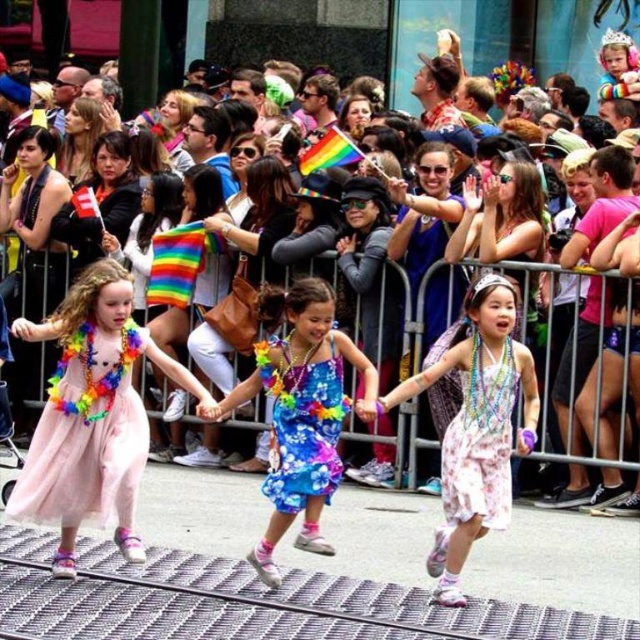
Between pearl beaded necklace at center and floral cotton dress at center, which one is positioned higher?

Positioned higher is pearl beaded necklace at center.

Is pearl beaded necklace at center below floral cotton dress at center?

No.

Describe the element at coordinates (476, 428) in the screenshot. This screenshot has width=640, height=640. I see `pearl beaded necklace at center` at that location.

Image resolution: width=640 pixels, height=640 pixels. I want to click on pearl beaded necklace at center, so click(476, 428).

Is floral fabric dress at center to the right of floral print fabric dress at center from the viewer's perspective?

No, floral fabric dress at center is not to the right of floral print fabric dress at center.

Does floral fabric dress at center have a greater height compared to floral print fabric dress at center?

Yes, floral fabric dress at center is taller than floral print fabric dress at center.

Describe the element at coordinates (301, 413) in the screenshot. Image resolution: width=640 pixels, height=640 pixels. I see `floral fabric dress at center` at that location.

In order to click on floral fabric dress at center in this screenshot , I will do `click(301, 413)`.

Between point (273, 476) and point (490, 364), which one is positioned in front?

Positioned in front is point (273, 476).

Does point (314, 536) come in front of point (465, 436)?

Yes, point (314, 536) is closer to viewer.

Image resolution: width=640 pixels, height=640 pixels. Find the location of `floral fabric dress at center`. floral fabric dress at center is located at coordinates (301, 413).